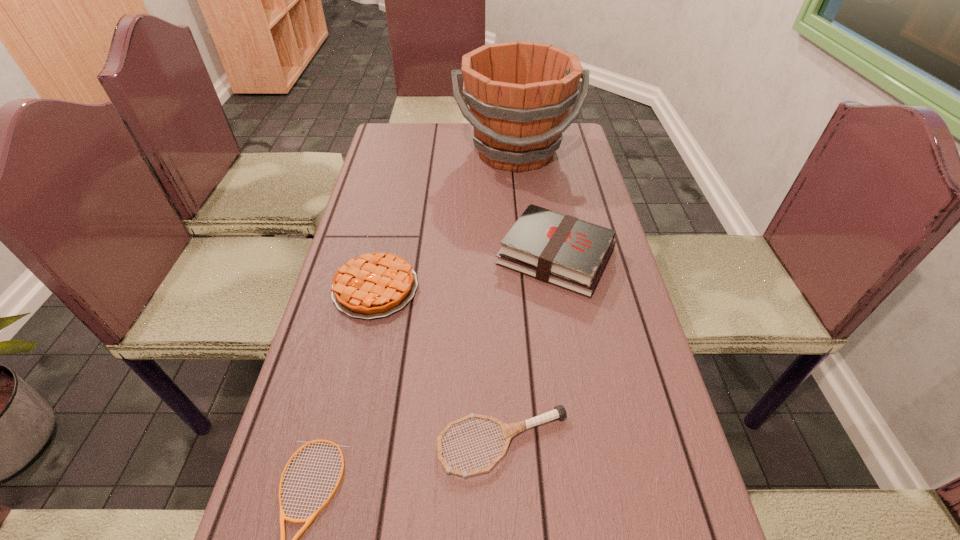
Locate an element on the screen. the tallest object is located at coordinates (519, 93).

You are a GUI agent. You are given a task and a screenshot of the screen. Output one action in this format:
    pyautogui.click(x=<x>, y=<y>)
    Task: Click on the bucket
    
    Given the screenshot: What is the action you would take?
    pyautogui.click(x=519, y=93)

This screenshot has width=960, height=540. Find the location of `the fourth shortest object`. the fourth shortest object is located at coordinates (558, 249).

Identify the location of pie. The height and width of the screenshot is (540, 960). (374, 285).

Image resolution: width=960 pixels, height=540 pixels. In order to click on the right tennis racket in this screenshot , I will do `click(509, 430)`.

What are the coordinates of `the taller tennis racket` in the screenshot? It's located at (509, 430).

This screenshot has height=540, width=960. I want to click on vacant space located on the handle side of the tallest object, so click(527, 262).

Find the location of a particular element. This screenshot has width=960, height=540. vacant space located 0.310m on the left of the hardback book is located at coordinates (379, 256).

Where is `vacant space located 0.390m on the front of the pie`? This screenshot has width=960, height=540. vacant space located 0.390m on the front of the pie is located at coordinates (327, 502).

Where is `vacant region located on the left of the fourth tallest object`? This screenshot has height=540, width=960. vacant region located on the left of the fourth tallest object is located at coordinates (372, 443).